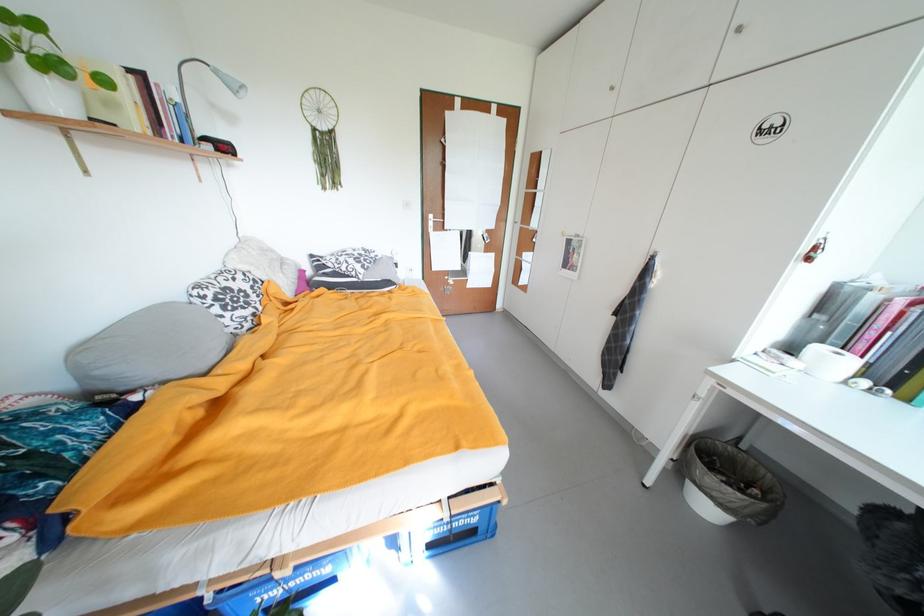
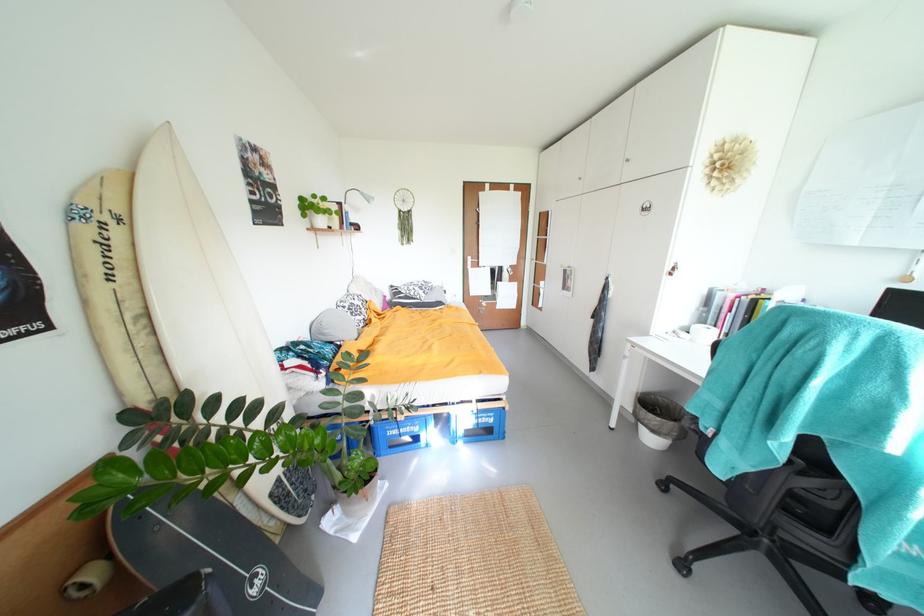
Question: What movement of the cameraman would produce the second image?

Choices:
 (A) Left
 (B) Right
 (C) Forward
 (D) Backward

Answer: (D)